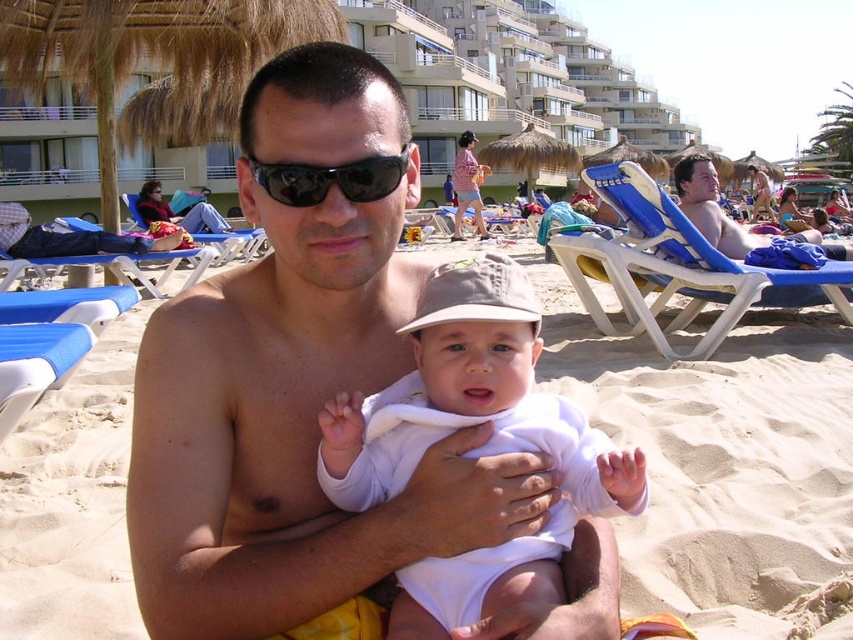
In the beach scene, there is a point labeled as point (724, 465). What does this point correspond to?

The point (724, 465) corresponds to the sandy beach at center.

You are a photographer trying to capture the entire sandy beach at center and the black reflective sunglasses at center in a single frame. Considering their sizes, will the sunglasses be a small detail in the photo?

The sandy beach at center is bigger than the black reflective sunglasses at center, so yes, the sunglasses will appear as a small detail in the photo.

You are standing at the beach and see the black reflective sunglasses at center. If you want to hand a pair of sunglasses to a friend who is 5 feet away from you, can you reach them without moving from your current position?

The black reflective sunglasses at center is 4.31 feet away from the viewer, so yes, you can reach them as 4.31 feet is less than 5 feet.